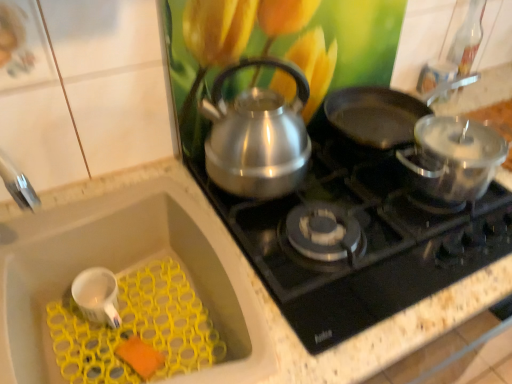
Question: Can you confirm if white matte sink at lower left is wider than polished stainless steel kettle at upper center?

Choices:
 (A) no
 (B) yes

Answer: (A)

Question: Is white matte sink at lower left thinner than polished stainless steel kettle at upper center?

Choices:
 (A) yes
 (B) no

Answer: (A)

Question: Considering the relative positions of white matte sink at lower left and polished stainless steel kettle at upper center in the image provided, is white matte sink at lower left in front of polished stainless steel kettle at upper center?

Choices:
 (A) yes
 (B) no

Answer: (A)

Question: Is white matte sink at lower left at the right side of polished stainless steel kettle at upper center?

Choices:
 (A) yes
 (B) no

Answer: (B)

Question: Can you confirm if white matte sink at lower left is taller than polished stainless steel kettle at upper center?

Choices:
 (A) no
 (B) yes

Answer: (B)

Question: From a real-world perspective, is white matte sink at lower left positioned under polished stainless steel kettle at upper center based on gravity?

Choices:
 (A) no
 (B) yes

Answer: (B)

Question: Is shiny black frying pan at upper right facing towards white matte sink at lower left?

Choices:
 (A) no
 (B) yes

Answer: (A)

Question: From the image's perspective, is shiny black frying pan at upper right on top of white matte sink at lower left?

Choices:
 (A) yes
 (B) no

Answer: (A)

Question: Is shiny black frying pan at upper right wider than white matte sink at lower left?

Choices:
 (A) no
 (B) yes

Answer: (A)

Question: Is shiny black frying pan at upper right not within white matte sink at lower left?

Choices:
 (A) no
 (B) yes

Answer: (B)

Question: Is shiny black frying pan at upper right turned away from white matte sink at lower left?

Choices:
 (A) yes
 (B) no

Answer: (B)

Question: Is white matte sink at lower left a part of shiny black frying pan at upper right?

Choices:
 (A) yes
 (B) no

Answer: (B)

Question: From the image's perspective, is shiny black frying pan at upper right over polished stainless steel kettle at upper center?

Choices:
 (A) no
 (B) yes

Answer: (B)